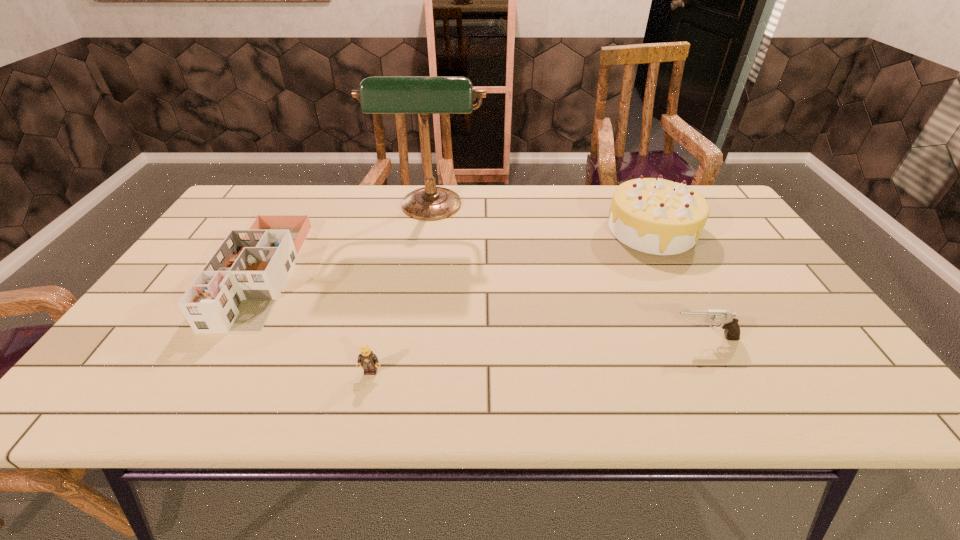
At what (x,y) coordinates should I click in order to perform the action: click on the tallest object. Please return your answer as a coordinate pair (x, y). Looking at the image, I should click on (424, 95).

Find the location of `birthday cake`. birthday cake is located at coordinates pyautogui.click(x=652, y=215).

Locate an element on the screen. The width and height of the screenshot is (960, 540). dollhouse is located at coordinates (235, 292).

Where is `gun`? gun is located at coordinates (729, 322).

Where is `Lego`? Lego is located at coordinates (367, 359).

Locate an element on the screen. The image size is (960, 540). vacant space located above the green lampshade of the table lamp is located at coordinates (421, 269).

Locate an element on the screen. vacant region located on the left of the second tallest object is located at coordinates (487, 230).

This screenshot has height=540, width=960. I want to click on free space located at the front door of the leftmost object, so click(x=205, y=373).

Where is `vacant space located at the muzzle of the gun`? The height and width of the screenshot is (540, 960). vacant space located at the muzzle of the gun is located at coordinates (622, 338).

Locate an element on the screen. blank space located 0.140m at the muzzle of the gun is located at coordinates (609, 338).